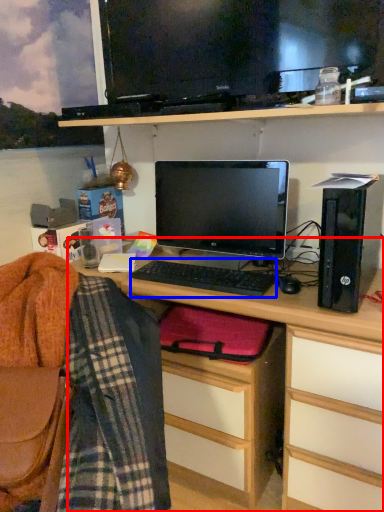
Question: Which point is closer to the camera, desk (highlighted by a red box) or computer keyboard (highlighted by a blue box)?

Choices:
 (A) desk
 (B) computer keyboard

Answer: (A)